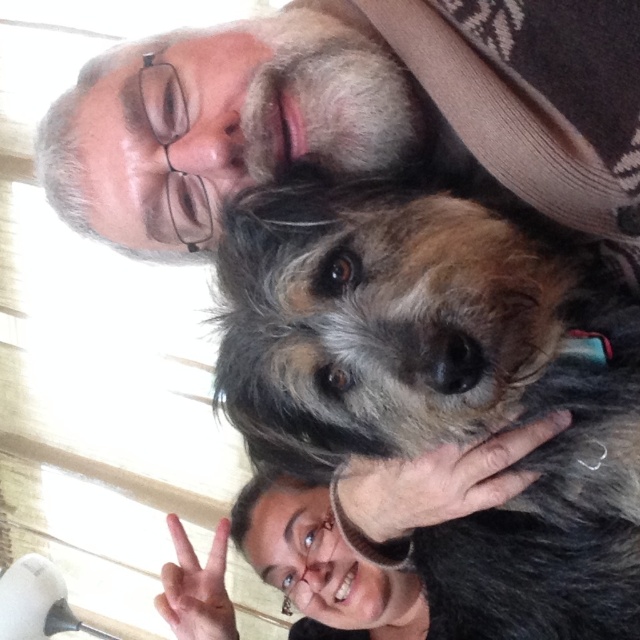
Which is above, fuzzy brown dog at center or gray beard at upper center?

gray beard at upper center is above.

Describe the element at coordinates (444, 378) in the screenshot. The width and height of the screenshot is (640, 640). I see `fuzzy brown dog at center` at that location.

The height and width of the screenshot is (640, 640). Identify the location of fuzzy brown dog at center. (444, 378).